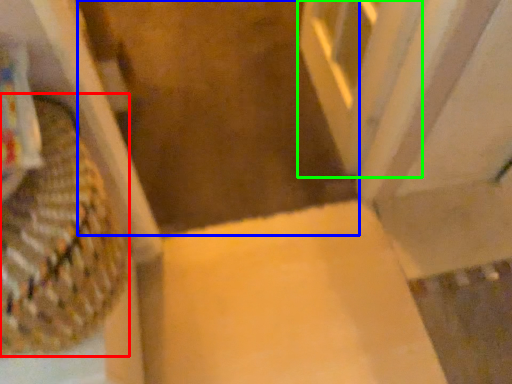
Question: Which is farther away from basket (highlighted by a red box)? aisle (highlighted by a blue box) or screen door (highlighted by a green box)?

Choices:
 (A) aisle
 (B) screen door

Answer: (A)